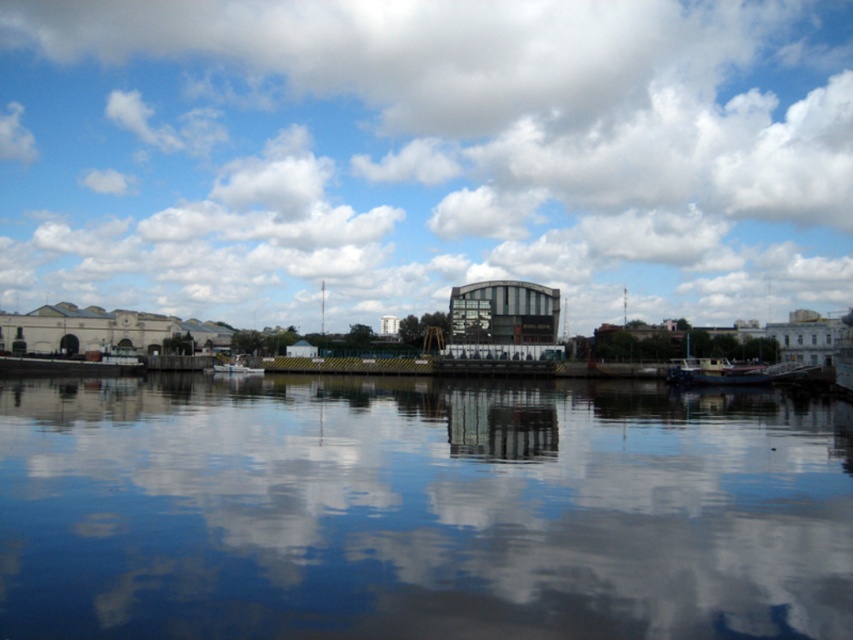
Question: Based on their relative distances, which object is farther from the cloudy sky at upper center?

Choices:
 (A) glossy glass building at center
 (B) transparent glass water at center

Answer: (A)

Question: Considering the relative positions of white fluffy cloud at upper center and white matte boat at center in the image provided, where is white fluffy cloud at upper center located with respect to white matte boat at center?

Choices:
 (A) above
 (B) below

Answer: (A)

Question: Is white fluffy cloud at upper center bigger than white matte boat at center?

Choices:
 (A) yes
 (B) no

Answer: (A)

Question: Among these objects, which one is farthest from the camera?

Choices:
 (A) white fluffy cloud at upper center
 (B) cloudy sky at upper center

Answer: (A)

Question: Can you confirm if cloudy sky at upper center is positioned to the right of transparent glass water at center?

Choices:
 (A) yes
 (B) no

Answer: (B)

Question: Among these objects, which one is farthest from the camera?

Choices:
 (A) wooden boat at right
 (B) white matte boat at center
 (C) white fluffy cloud at upper center

Answer: (C)